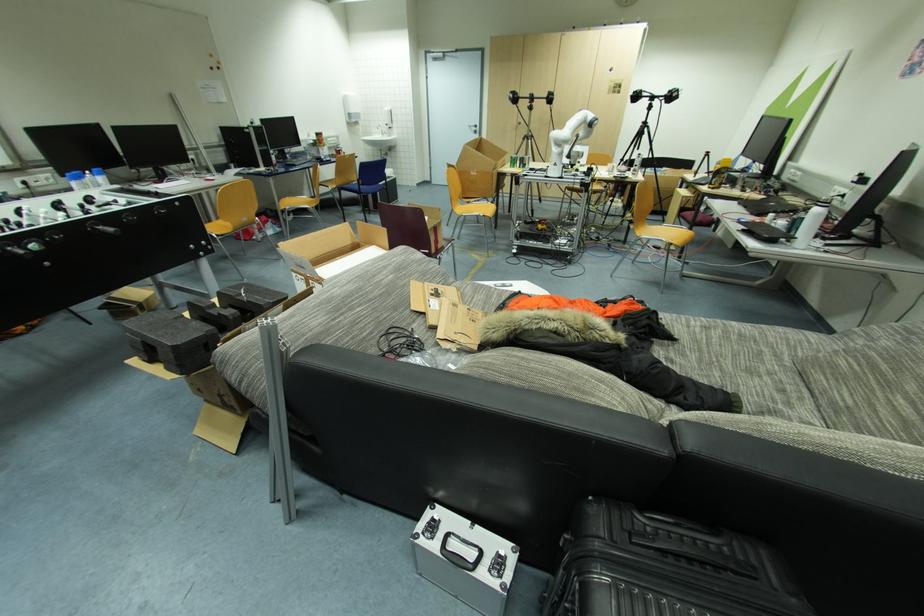
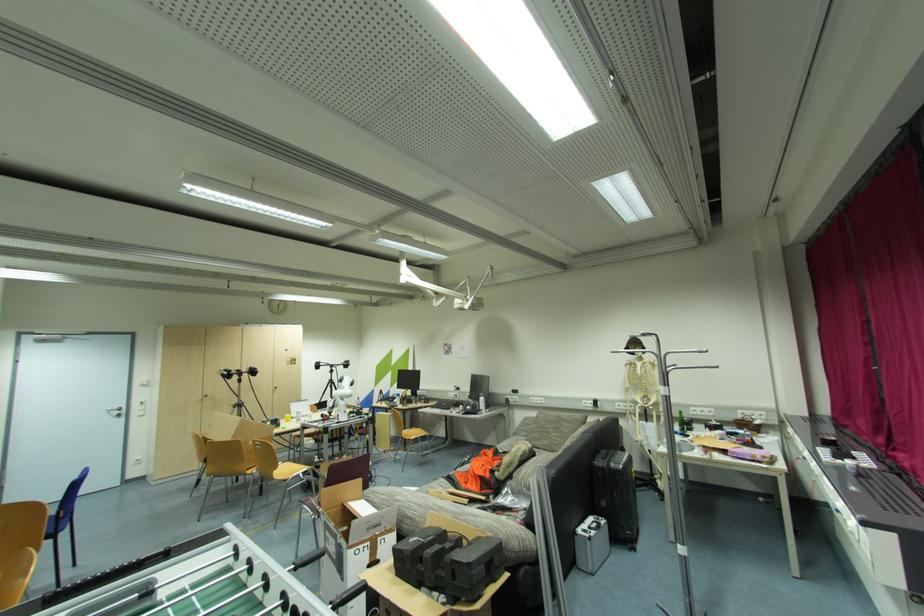
Locate, in the second image, the point that corresponds to (478,130) in the first image.

(122, 413)